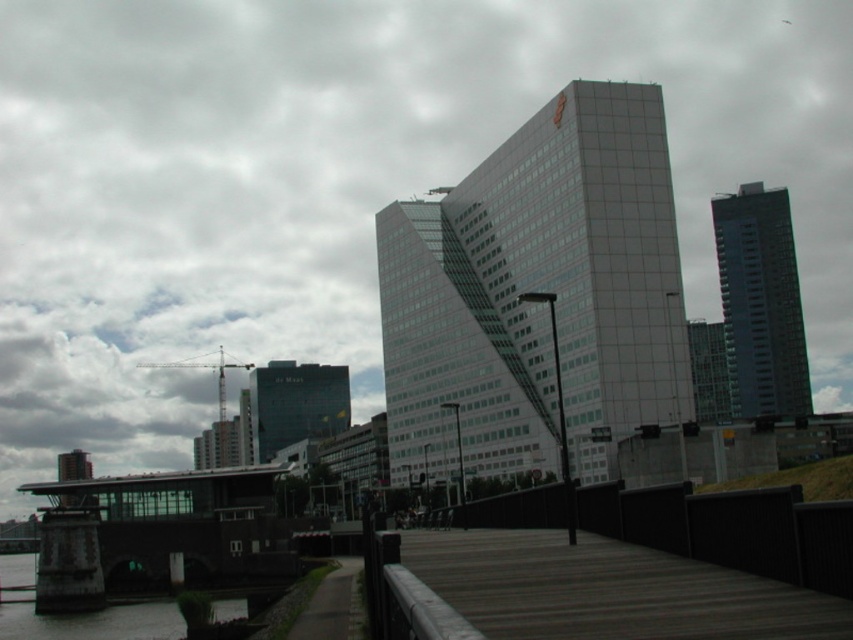
You are standing at the wooden walkway and want to take a photo of both the point at coordinates point (515, 310) and point (293, 634). Since you can only focus on one point at a time, which point should you focus on first to ensure the other is still in the frame?

You should focus on point (515, 310) first because it is closer to you than point (293, 634). By focusing on the closer point first, the farther point will still be within the frame as long as both are within the camera lens range.

You are a delivery person carrying a heavy box and need to reach the wooden dock at center from the dark gray asphalt path at lower left. Is the path accessible from the dock?

The wooden dock at center is positioned over dark gray asphalt path at lower left, meaning the path is underneath the dock. Since the dock is above, you cannot directly access the path from the dock.

Consider the image. You are a pedestrian standing on the dark gray asphalt path at lower left and want to reach the dark glass building at center. Based on the scene description, which direction should you move relative to the path?

The dark glass building at center is positioned under the dark gray asphalt path at lower left, so you should move downward along the path towards the building.